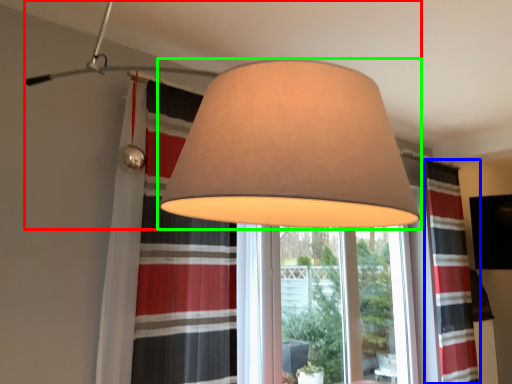
Question: Which object is the closest to the lamp (highlighted by a red box)? Choose among these: curtain (highlighted by a blue box) or lamp (highlighted by a green box).

Choices:
 (A) curtain
 (B) lamp

Answer: (B)